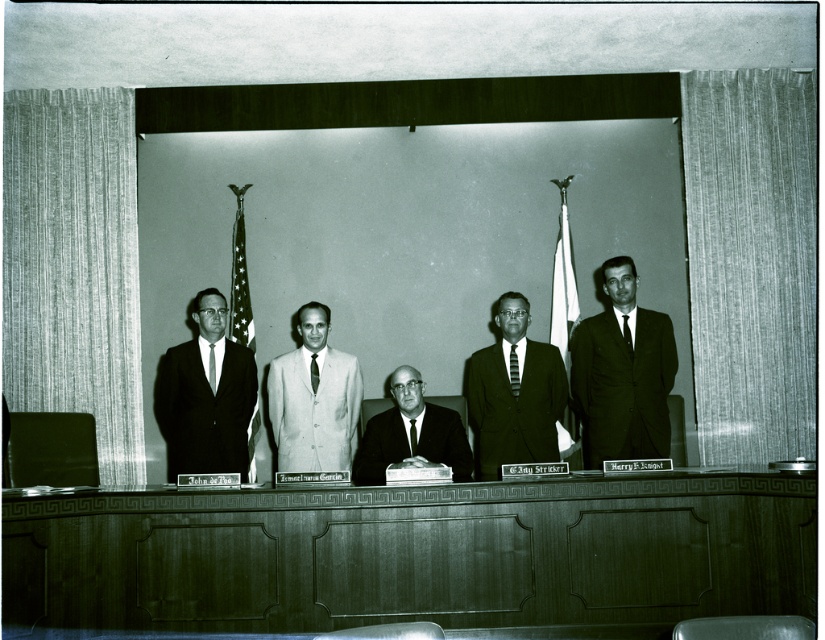
Does light gray suit at center appear on the left side of smooth black suit at center?

Indeed, light gray suit at center is positioned on the left side of smooth black suit at center.

Which of these two, light gray suit at center or smooth black suit at center, stands taller?

Standing taller between the two is light gray suit at center.

This screenshot has height=640, width=825. Identify the location of light gray suit at center. (314, 400).

Looking at this image, who is positioned more to the left, dark green suit at right or striped fabric tie at center?

From the viewer's perspective, striped fabric tie at center appears more on the left side.

Based on the photo, how distant is dark green suit at right from striped fabric tie at center?

59.81 centimeters

Who is more distant from viewer, (630, 305) or (515, 355)?

The point (515, 355) is behind.

The width and height of the screenshot is (825, 640). Identify the location of dark green suit at right. (621, 372).

Is point (640, 432) positioned behind point (182, 456)?

No, (640, 432) is in front of (182, 456).

Is dark green suit at right to the right of dark suit at center from the viewer's perspective?

Yes, dark green suit at right is to the right of dark suit at center.

Is point (597, 449) closer to viewer compared to point (165, 417)?

Yes, it is.

This screenshot has width=825, height=640. I want to click on dark green suit at right, so click(621, 372).